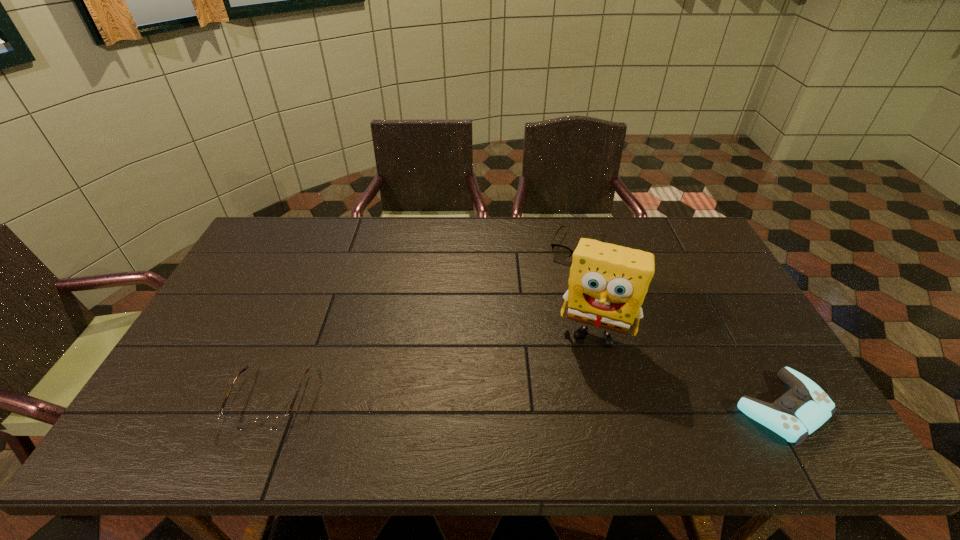
Locate an element on the screen. The image size is (960, 540). free spot on the desktop that is between the left spectacles and the rightmost object and is positioned on the face of the farthest object is located at coordinates (517, 403).

Locate an element on the screen. free space on the desktop that is between the left spectacles and the rightmost object and is positioned on the face of the second farthest object is located at coordinates (578, 404).